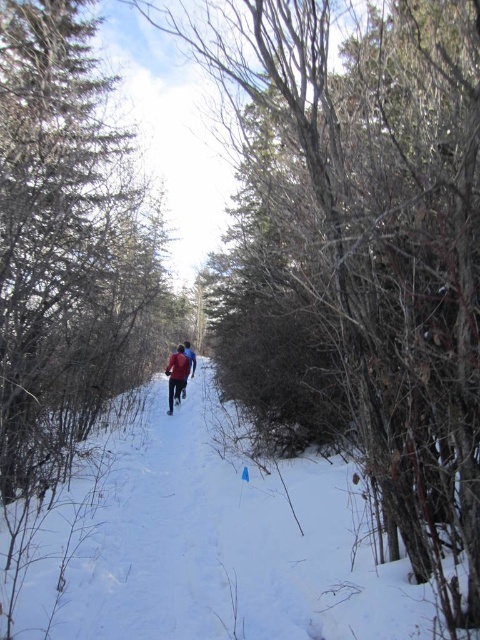
Is white powdery snow at center to the right of brown textured tree at center from the viewer's perspective?

Correct, you'll find white powdery snow at center to the right of brown textured tree at center.

Does white powdery snow at center come behind brown textured tree at center?

Yes, it is.

The width and height of the screenshot is (480, 640). What do you see at coordinates (204, 541) in the screenshot?
I see `white powdery snow at center` at bounding box center [204, 541].

This screenshot has width=480, height=640. Find the location of `white powdery snow at center`. white powdery snow at center is located at coordinates (204, 541).

Identify the location of white powdery snow at center. The width and height of the screenshot is (480, 640). (204, 541).

Does white powdery snow at center appear on the left side of red fabric jacket at center?

Indeed, white powdery snow at center is positioned on the left side of red fabric jacket at center.

Between point (228, 476) and point (166, 372), which one is positioned in front?

Positioned in front is point (228, 476).

Locate an element on the screen. This screenshot has height=640, width=480. white powdery snow at center is located at coordinates (204, 541).

Where is `brown textured tree at center`? The image size is (480, 640). brown textured tree at center is located at coordinates (63, 237).

Does point (64, 412) come closer to viewer compared to point (181, 369)?

Yes, point (64, 412) is in front of point (181, 369).

Identify the location of brown textured tree at center. (63, 237).

Where is `brown textured tree at center`? brown textured tree at center is located at coordinates tap(63, 237).